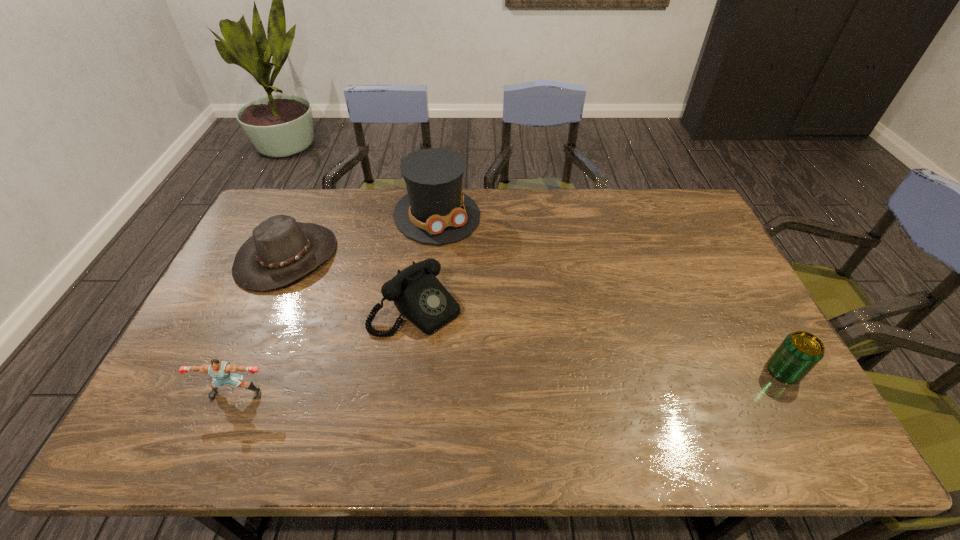
Locate an element on the screen. Image resolution: width=960 pixels, height=540 pixels. puncher is located at coordinates (223, 372).

Locate an element on the screen. beer can is located at coordinates (799, 352).

At what (x,y) coordinates should I click in order to perform the action: click on telephone. Please return your answer as a coordinate pair (x, y). The image size is (960, 540). Looking at the image, I should click on (418, 295).

Locate an element on the screen. The width and height of the screenshot is (960, 540). dress hat is located at coordinates [435, 211].

Where is `hat`? The width and height of the screenshot is (960, 540). hat is located at coordinates (281, 250).

In order to click on vacant space positioned on the left of the rightmost object in this screenshot , I will do `click(629, 372)`.

In order to click on vacant region located 0.100m on the dial of the telephone in this screenshot , I will do `click(468, 353)`.

At what (x,y) coordinates should I click in order to perform the action: click on free space located on the dial of the telephone. Please return your answer as a coordinate pair (x, y). This screenshot has height=540, width=960. Looking at the image, I should click on (489, 373).

Locate an element on the screen. Image resolution: width=960 pixels, height=540 pixels. free space located 0.190m on the dial of the telephone is located at coordinates (491, 375).

Locate an element on the screen. The width and height of the screenshot is (960, 540). vacant space located with goggles on the front of the dress hat is located at coordinates tap(504, 308).